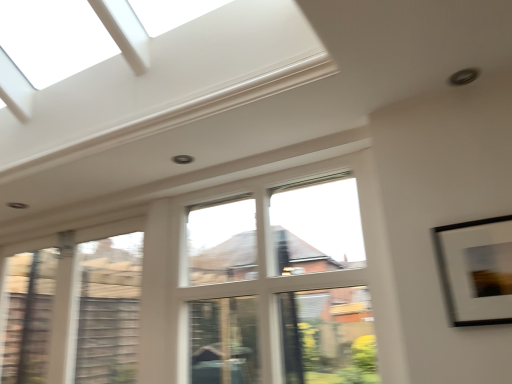
Question: Is white matte picture frame at upper right smaller than clear glass window at left, positioned as the 1th window in left-to-right order?

Choices:
 (A) yes
 (B) no

Answer: (A)

Question: Considering the relative sizes of white matte picture frame at upper right and clear glass window at left, placed as the second window when sorted from right to left, in the image provided, is white matte picture frame at upper right taller than clear glass window at left, placed as the second window when sorted from right to left,?

Choices:
 (A) yes
 (B) no

Answer: (B)

Question: Is white matte picture frame at upper right placed right next to clear glass window at left, positioned as the 1th window in left-to-right order?

Choices:
 (A) no
 (B) yes

Answer: (A)

Question: Is white matte picture frame at upper right shorter than clear glass window at left, placed as the second window when sorted from right to left?

Choices:
 (A) yes
 (B) no

Answer: (A)

Question: Is white matte picture frame at upper right positioned before clear glass window at left, positioned as the 1th window in left-to-right order?

Choices:
 (A) yes
 (B) no

Answer: (A)

Question: From the image's perspective, is clear glass window at center, acting as the 1th window starting from the right, positioned above or below clear glass window at left, positioned as the 1th window in left-to-right order?

Choices:
 (A) above
 (B) below

Answer: (A)

Question: Does point (373, 208) appear closer or farther from the camera than point (135, 296)?

Choices:
 (A) farther
 (B) closer

Answer: (B)

Question: Is clear glass window at center, acting as the 1th window starting from the right, inside or outside of clear glass window at left, placed as the second window when sorted from right to left?

Choices:
 (A) inside
 (B) outside

Answer: (B)

Question: Based on their positions, is clear glass window at center, the second window positioned from the left, located to the left or right of clear glass window at left, positioned as the 1th window in left-to-right order?

Choices:
 (A) left
 (B) right

Answer: (B)

Question: In the image, is white matte picture frame at upper right positioned in front of or behind clear glass window at left, placed as the second window when sorted from right to left?

Choices:
 (A) behind
 (B) front

Answer: (B)

Question: Does point (504, 279) appear closer or farther from the camera than point (86, 259)?

Choices:
 (A) farther
 (B) closer

Answer: (B)

Question: Visually, is white matte picture frame at upper right positioned to the left or to the right of clear glass window at left, positioned as the 1th window in left-to-right order?

Choices:
 (A) left
 (B) right

Answer: (B)

Question: From the image's perspective, is white matte picture frame at upper right positioned above or below clear glass window at left, placed as the second window when sorted from right to left?

Choices:
 (A) above
 (B) below

Answer: (A)

Question: From the image's perspective, is clear glass window at left, positioned as the 1th window in left-to-right order, located above or below white matte picture frame at upper right?

Choices:
 (A) above
 (B) below

Answer: (B)

Question: Would you say clear glass window at left, positioned as the 1th window in left-to-right order, is to the left or to the right of white matte picture frame at upper right in the picture?

Choices:
 (A) left
 (B) right

Answer: (A)